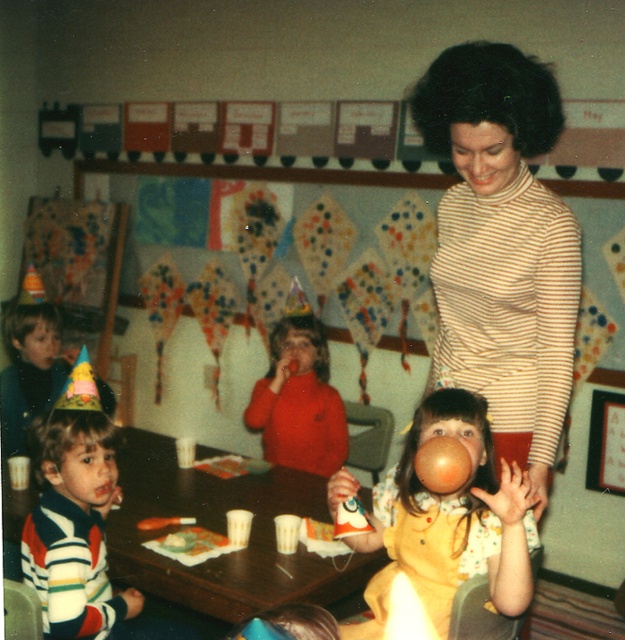
Question: Which object is positioned closest to the striped sweater at lower left?

Choices:
 (A) matte yellow dress at center
 (B) wooden table at lower center

Answer: (B)

Question: Does matte yellow dress at center appear on the right side of matte orange sweater at center?

Choices:
 (A) no
 (B) yes

Answer: (B)

Question: Which object is the farthest from the matte orange sweater at center?

Choices:
 (A) striped sweater at lower left
 (B) wooden table at lower center

Answer: (A)

Question: Among these points, which one is nearest to the camera?

Choices:
 (A) (538, 272)
 (B) (410, 554)
 (C) (86, 529)

Answer: (A)

Question: Is striped turtleneck sweater at center wider than striped sweater at lower left?

Choices:
 (A) no
 (B) yes

Answer: (B)

Question: Does wooden table at lower center come in front of matte orange sweater at center?

Choices:
 (A) yes
 (B) no

Answer: (A)